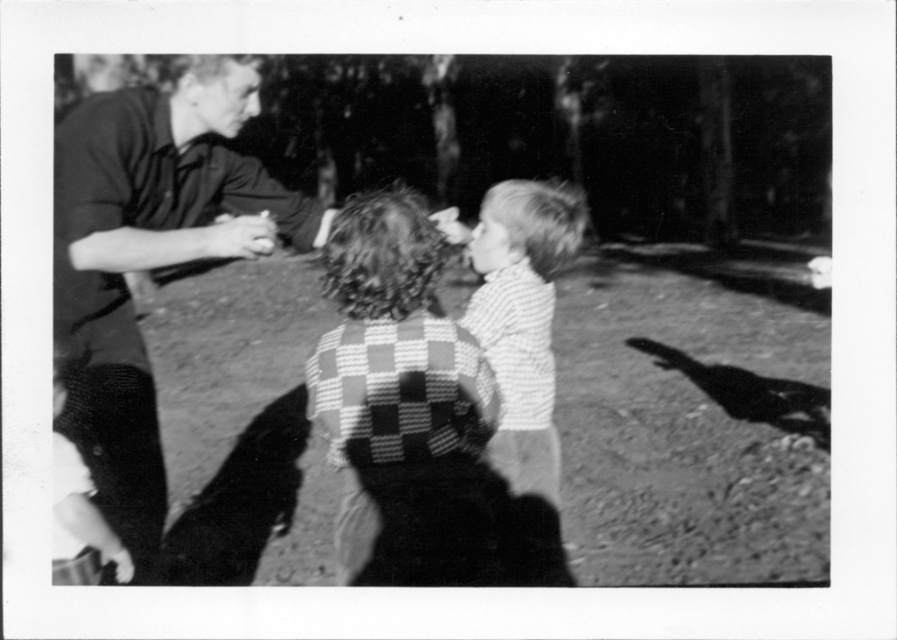
You are a photographer trying to capture a candid shot of the striped cotton shirt at center and the smooth skin hand at center. Considering the distance between them, would you need to adjust your camera settings for depth of field to ensure both are in focus?

The striped cotton shirt at center and the smooth skin hand at center are 23.00 feet apart from each other. To ensure both are in focus, you would need to adjust your camera settings for a larger depth of field, which can be achieved by using a smaller aperture.

You are a photographer trying to capture a candid shot of the smooth dark shirt at left. You are currently positioned 1.5 meters away from it. Can you take the photo without moving closer?

The smooth dark shirt at left is 2.20 meters from the camera. Since you are 1.5 meters away from it, you can take the photo without moving closer.

You are a photographer trying to capture a closeup of the two points in the image. The first point is at coordinate point (103, 385) and the second is at point (475, 316). Since you want the closest point to be in focus, which point should you focus on?

Point (103, 385) is closer to the camera than point (475, 316), so you should focus on point (103, 385) to ensure it is in focus.